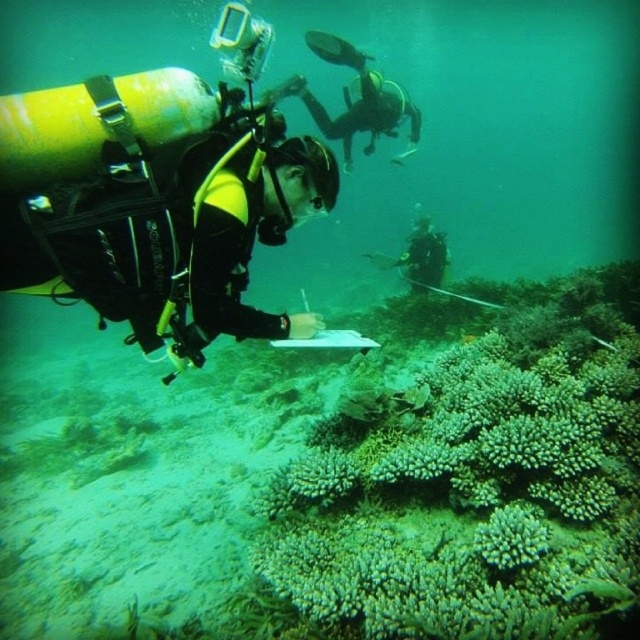
Question: Which of the following is the closest to the observer?

Choices:
 (A) green matte coral at center
 (B) shiny silver fish at upper center
 (C) black scuba diver at center
 (D) yellow matte wetsuit at center

Answer: (A)

Question: Which object appears farthest from the camera in this image?

Choices:
 (A) black scuba diver at center
 (B) yellow matte wetsuit at center
 (C) shiny silver fish at upper center
 (D) green matte coral at center

Answer: (C)

Question: Is yellow matte wetsuit at center closer to camera compared to shiny silver fish at upper center?

Choices:
 (A) no
 (B) yes

Answer: (B)

Question: Can you confirm if green matte coral at center is thinner than shiny silver fish at upper center?

Choices:
 (A) no
 (B) yes

Answer: (B)

Question: Among these points, which one is farthest from the camera?

Choices:
 (A) (93, 204)
 (B) (436, 244)

Answer: (B)

Question: Is green matte coral at center further to camera compared to shiny silver fish at upper center?

Choices:
 (A) yes
 (B) no

Answer: (B)